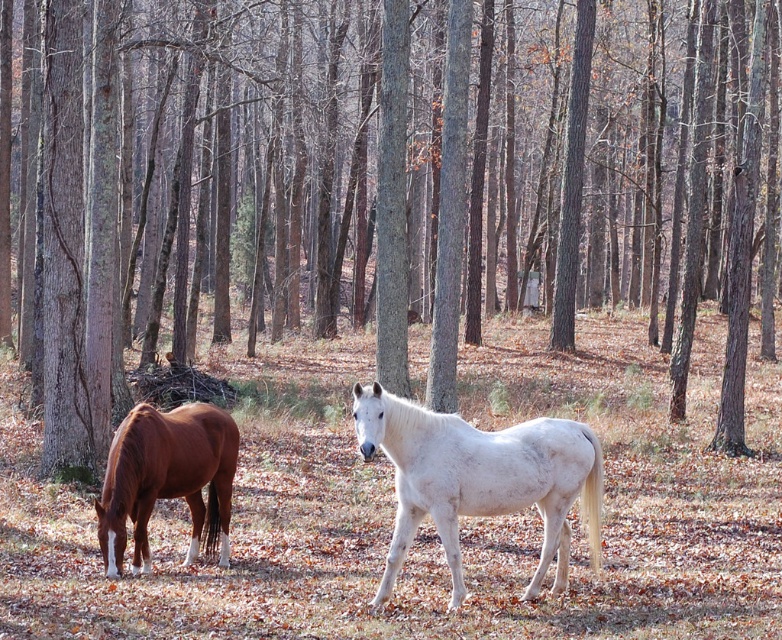
From the picture: You are a hiker who wants to cross the forest area. You notice brown grass at center and a brown glossy horse at left. Which object is taller from your viewpoint?

The brown grass at center is taller than the brown glossy horse at left.

You are a photographer planning to take a photo of the white matte horse at center and the brown grass at center in the forest scene. Based on their sizes, which object should you focus on to ensure both are in frame without needing to adjust your camera angle?

The brown grass at center is larger in size compared to the white matte horse at center. To ensure both are in frame without adjusting the camera angle, focus on the larger brown grass at center since it occupies more space in the scene.

You are standing in the forest and see two horses. One is at point (x=427, y=516) which is brown grass at center. Can you tell me which horse is closer to the brown grass at center?

The brown grass at center is located at point (x=427, y=516), so the horse at that point is the one closer to the brown grass at center.